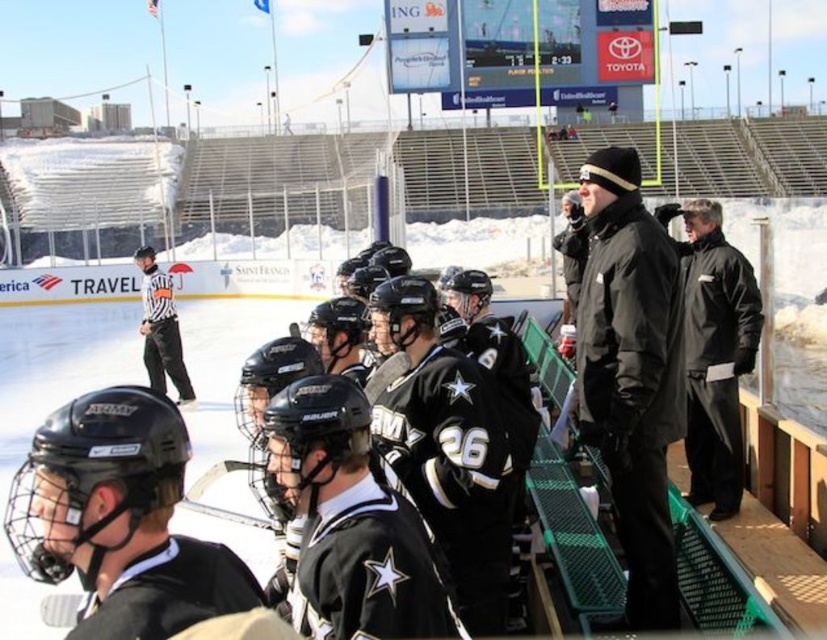
You are a spectator at the ice hockey game and want to take a photo of both the black matte jacket at upper right and the black matte jacket at right. Which jacket will appear smaller in your photo?

The black matte jacket at upper right will appear smaller in the photo because it occupies less space than the black matte jacket at right.

You are a photographer trying to capture a photo of the black matte hockey helmets at center and the black matte jacket at upper right. Based on their positions, which object should appear larger in the photo?

The black matte hockey helmets at center is taller than the black matte jacket at upper right, so it should appear larger in the photo.